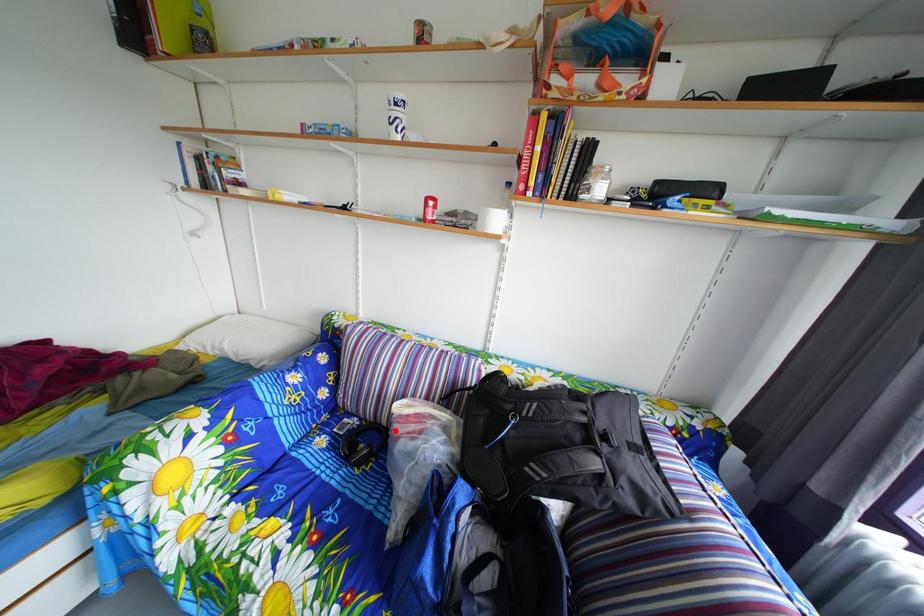
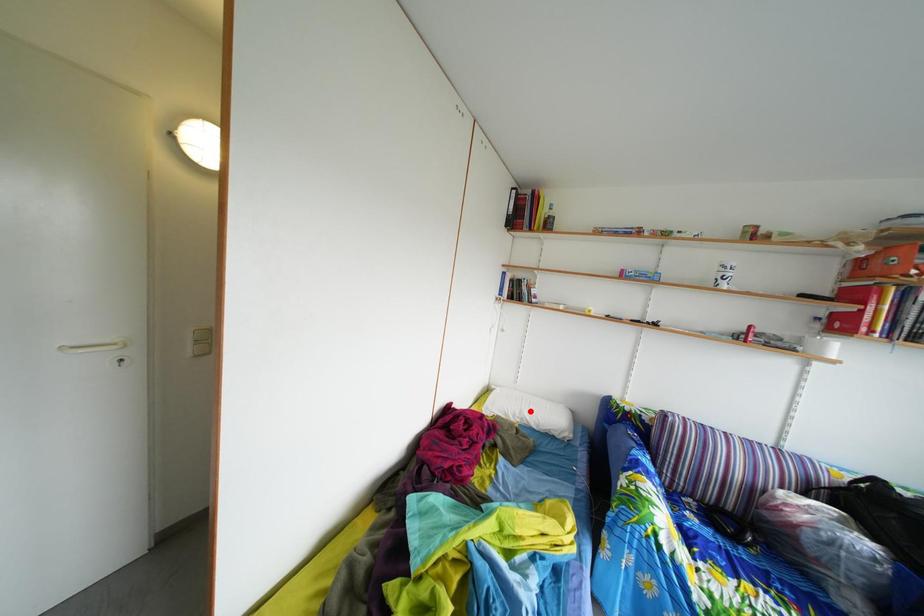
I am providing you with two images of the same scene from different viewpoints. A red point is marked on the first image and another point is marked on the second image. Is the red point in image1 aligned with the point shown in image2?

No